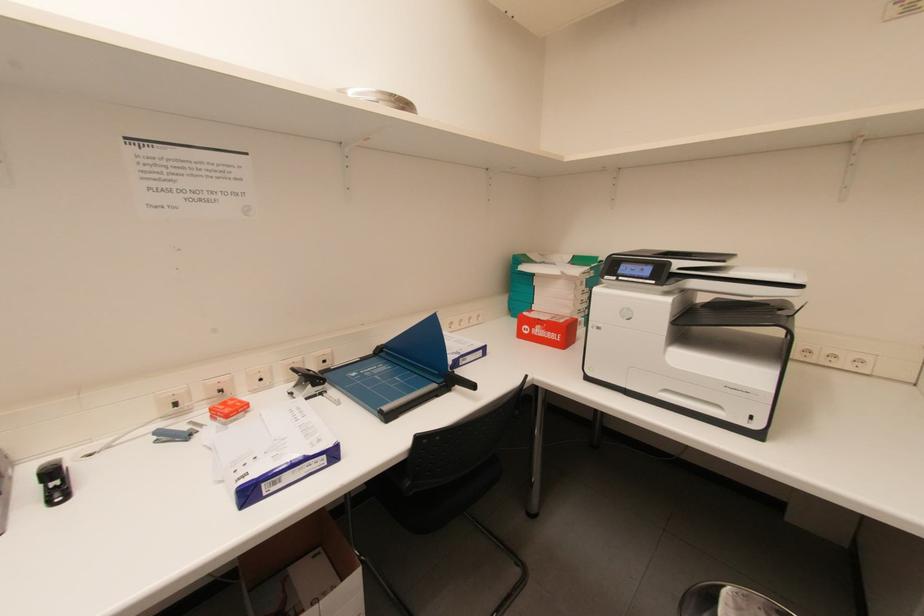
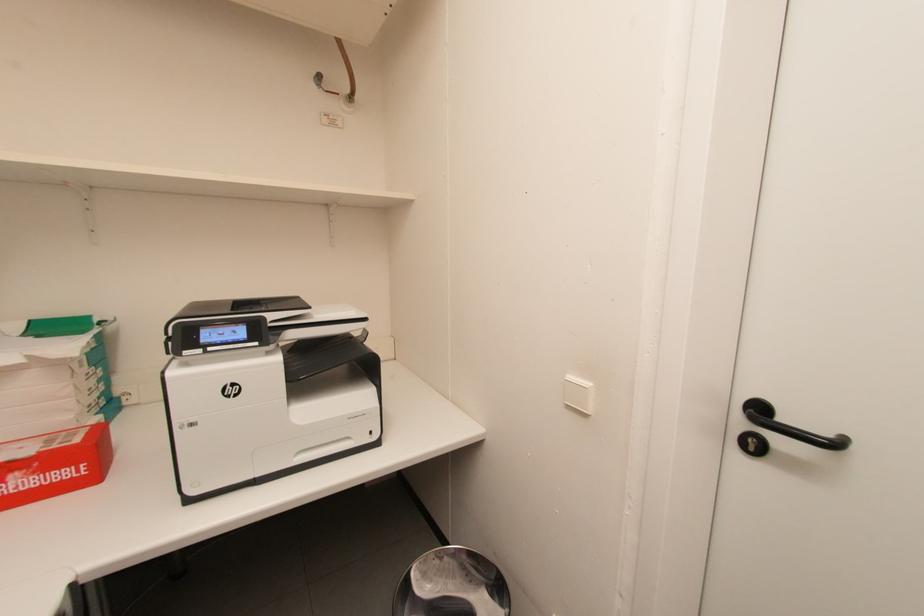
Question: How did the camera likely rotate?

Choices:
 (A) Left
 (B) Right
 (C) Up
 (D) Down

Answer: (B)